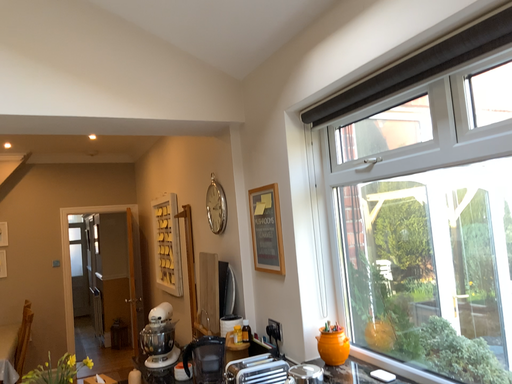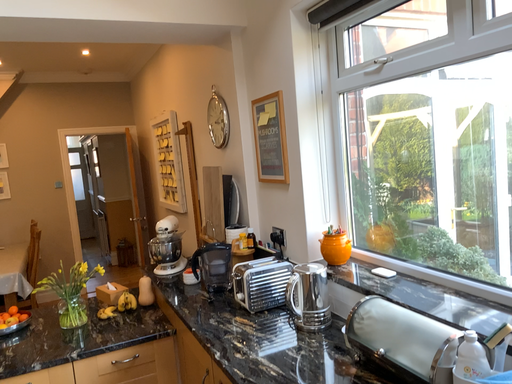
Question: Which way did the camera rotate in the video?

Choices:
 (A) rotated upward
 (B) rotated downward

Answer: (B)